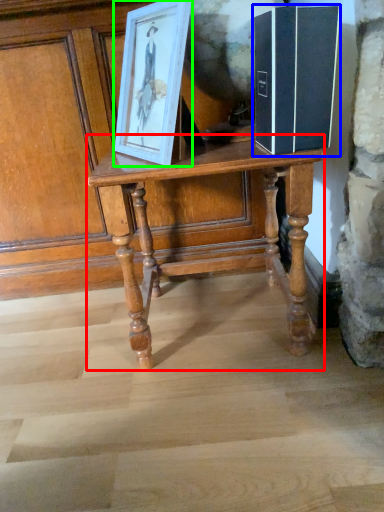
Question: Which object is the farthest from table (highlighted by a red box)? Choose among these: book (highlighted by a blue box) or picture frame (highlighted by a green box).

Choices:
 (A) book
 (B) picture frame

Answer: (A)